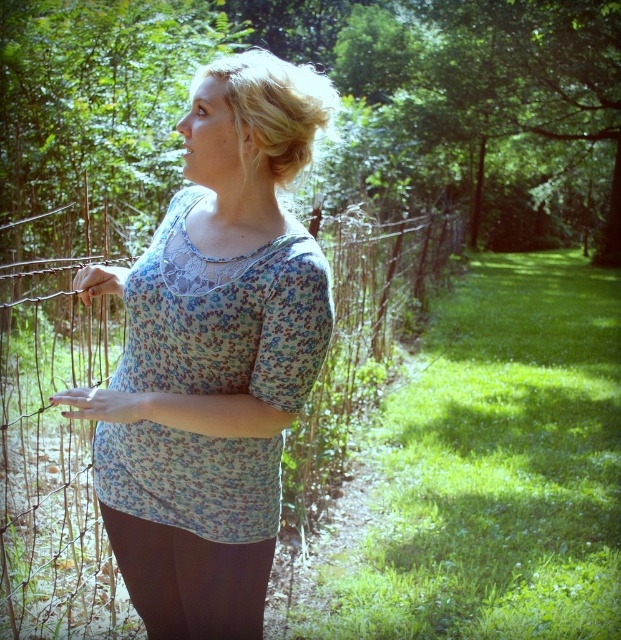
Question: Is floral-patterned fabric shirt at center bigger than black leggings at lower center?

Choices:
 (A) yes
 (B) no

Answer: (A)

Question: Does floral-patterned fabric shirt at center appear on the right side of black leggings at lower center?

Choices:
 (A) no
 (B) yes

Answer: (A)

Question: Among these points, which one is farthest from the camera?

Choices:
 (A) (104, 458)
 (B) (132, 540)

Answer: (B)

Question: Which object is closer to the camera taking this photo?

Choices:
 (A) floral-patterned fabric shirt at center
 (B) black leggings at lower center

Answer: (A)

Question: Does floral-patterned fabric shirt at center come in front of black leggings at lower center?

Choices:
 (A) no
 (B) yes

Answer: (B)